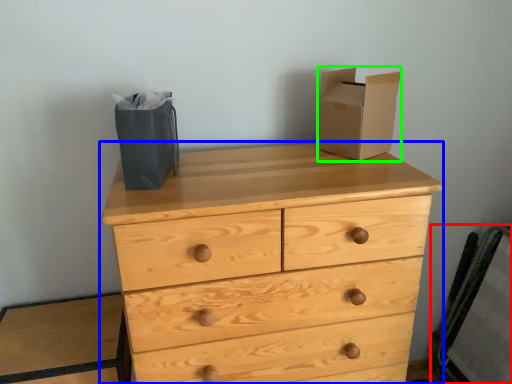
Question: Estimate the real-world distances between objects in this image. Which object is closer to chair (highlighted by a red box), chest of drawers (highlighted by a blue box) or cardboard box (highlighted by a green box)?

Choices:
 (A) chest of drawers
 (B) cardboard box

Answer: (A)